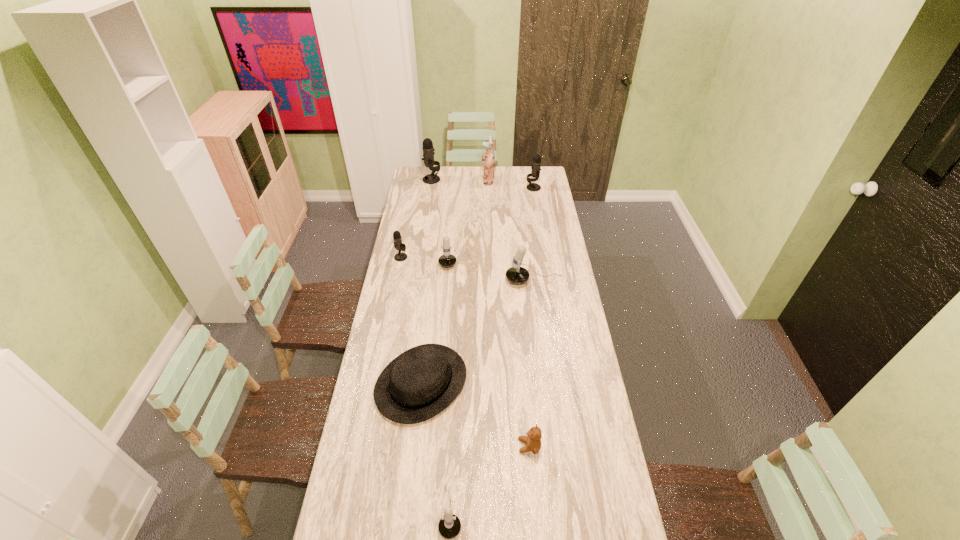
This screenshot has height=540, width=960. What are the coordinates of `vacant space located on the right of the nearest black microphone` in the screenshot? It's located at (421, 257).

Where is `vacant region located 0.050m on the front-facing side of the eighth farthest object`? This screenshot has width=960, height=540. vacant region located 0.050m on the front-facing side of the eighth farthest object is located at coordinates (503, 446).

The height and width of the screenshot is (540, 960). Find the location of `vacant point located on the front-facing side of the eighth farthest object`. vacant point located on the front-facing side of the eighth farthest object is located at coordinates (417, 446).

Identify the location of vacant space located on the front-facing side of the eighth farthest object. This screenshot has height=540, width=960. (497, 446).

The width and height of the screenshot is (960, 540). I want to click on free space located 0.210m on the right of the black fedora, so click(x=523, y=383).

At what (x,y) coordinates should I click in order to perform the action: click on figurine positioned at the far edge. Please return your answer as a coordinate pair (x, y). The height and width of the screenshot is (540, 960). Looking at the image, I should click on (488, 159).

The height and width of the screenshot is (540, 960). I want to click on fedora at the left edge, so click(420, 383).

Locate an element on the screen. object at the far left corner is located at coordinates (428, 150).

Where is `object present at the far right corner`? The image size is (960, 540). object present at the far right corner is located at coordinates (536, 163).

This screenshot has width=960, height=540. What are the coordinates of `free location at the far edge of the desktop` in the screenshot? It's located at (520, 182).